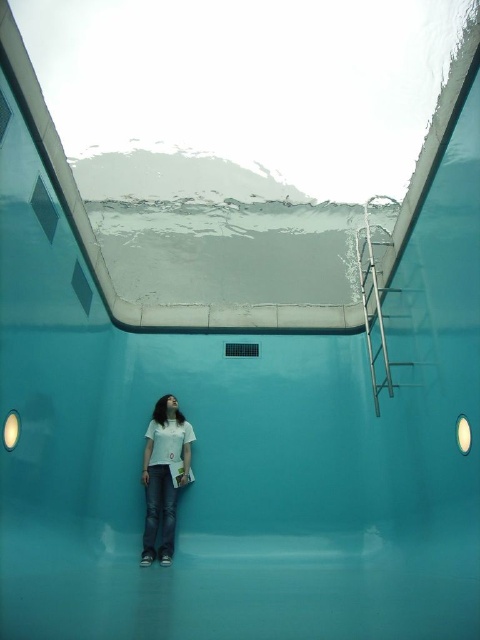
You are an interior designer assessing the space. You need to determine if the metallic silver ladder at upper right can be moved without disturbing the white matte shirt at center. Based on their positions, is this possible?

The metallic silver ladder at upper right is in front of the white matte shirt at center, so moving the ladder might require the person to step aside or move the shirt first to avoid obstruction.

You are an interior designer assessing the space. You need to determine if the metallic silver ladder at upper right can be used to reach the ceiling lights without the white matte shirt at center obstructing the path. Can you confirm if there is enough vertical clearance between them?

The metallic silver ladder at upper right is taller than the white matte shirt at center, so there should be sufficient vertical clearance for the ladder to reach the ceiling lights without obstruction from the shirt.

From the picture: You are an interior designer assessing the space. You need to determine if the metallic silver ladder at upper right can be safely accessed from the white matte shirt at center position. Is the ladder positioned above the person?

The metallic silver ladder at upper right is above the white matte shirt at center, so yes, the ladder is positioned above the person.